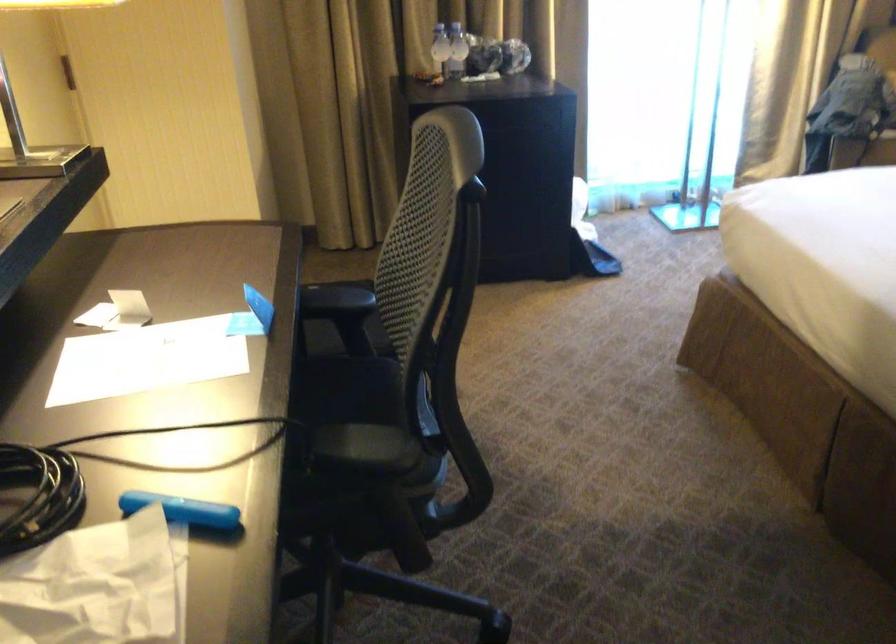
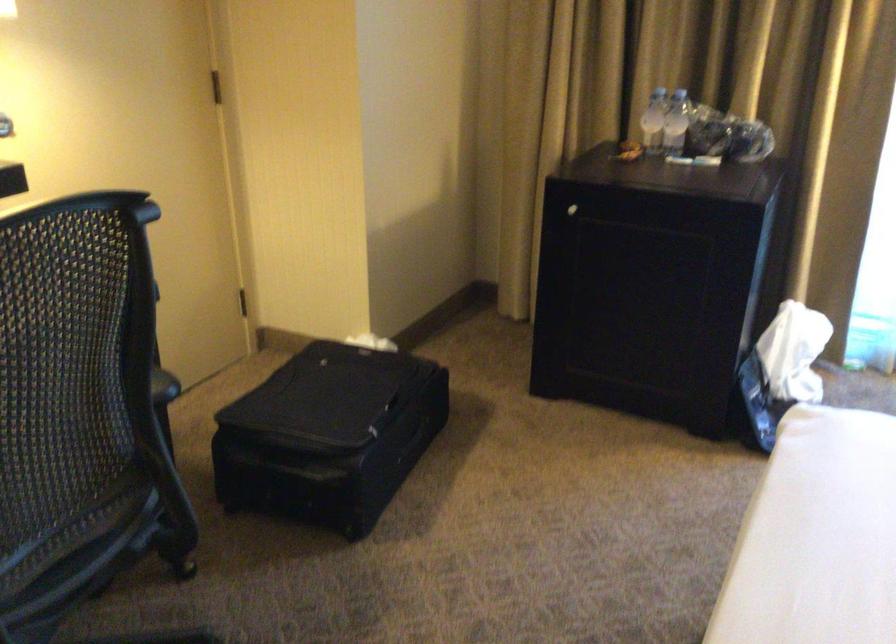
Question: I am providing you with two images of the same scene from different viewpoints. Please identify which objects are invisible in image2.

Choices:
 (A) clear water bottle
 (B) cabinet door handle
 (C) black chair armrest
 (D) none of these

Answer: (D)